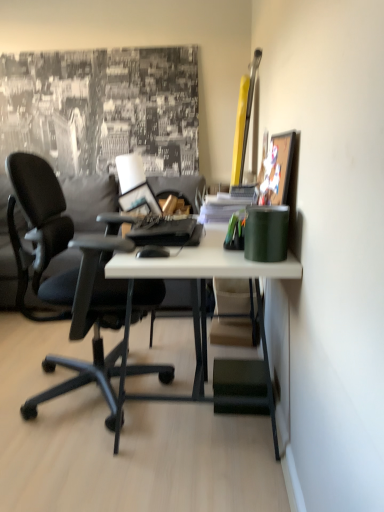
The height and width of the screenshot is (512, 384). Identify the location of vacant area that lies in front of black matte mouse at center. click(x=159, y=260).